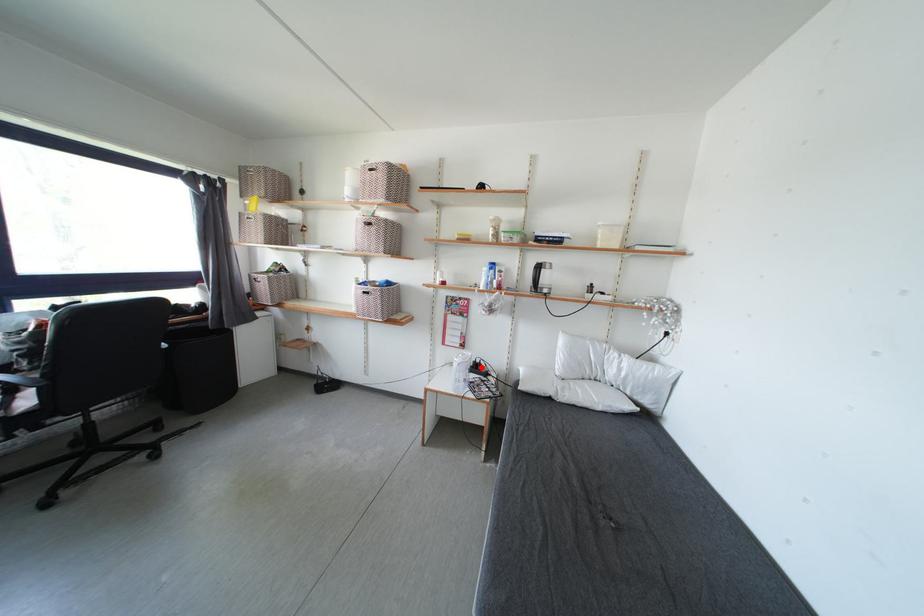
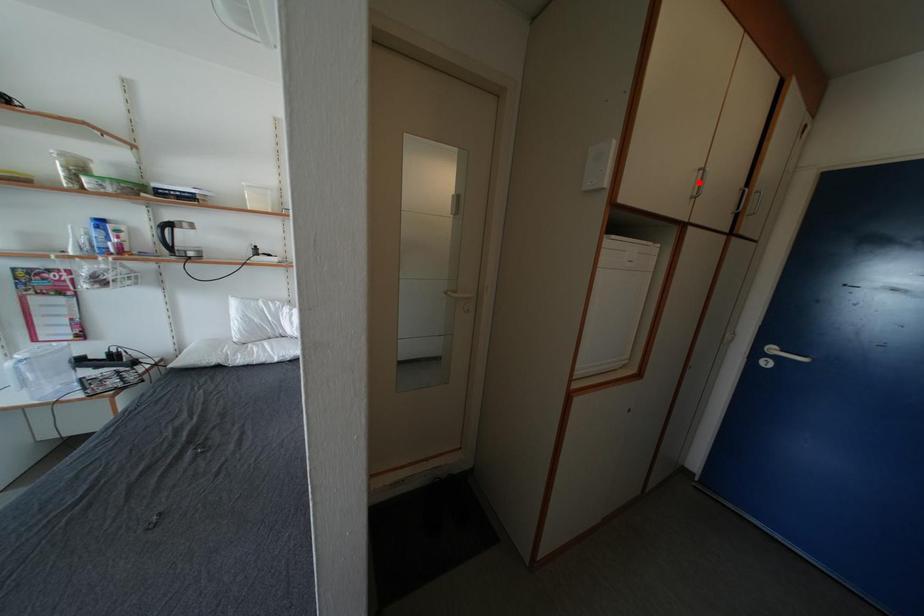
I am providing you with two images of the same scene from different viewpoints. A red point is marked on the first image and another point is marked on the second image. Is the red point in image1 aligned with the point shown in image2?

No